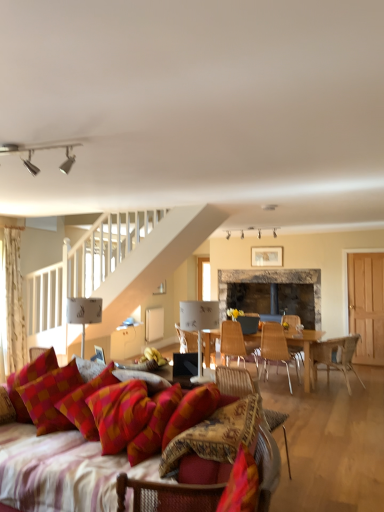
Identify the location of empty space that is ontop of silver metallic track lights at upper center, placed as the 3th lamp when sorted from back to front (from a real-world perspective). (47, 141).